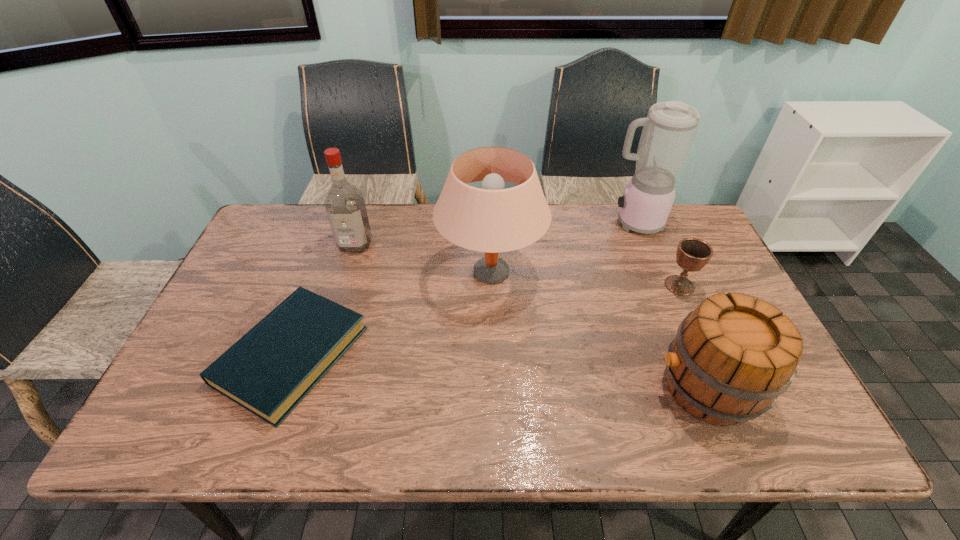
Where is `free area in between the shortest object and the fourth tallest object`? This screenshot has width=960, height=540. free area in between the shortest object and the fourth tallest object is located at coordinates (499, 372).

Locate which object is the closest to the lampshade. Please provide its 2D coordinates. Your answer should be formatted as a tuple, i.e. [(x, y)], where the tuple contains the x and y coordinates of a point satisfying the conditions above.

[(268, 371)]

Where is `object that is the second closest one to the food processor`? The image size is (960, 540). object that is the second closest one to the food processor is located at coordinates (493, 219).

Where is `free space that satisfies the following two spatial constraints: 1. on the front-facing side of the third object from left to right; 2. on the right side of the second shortest object`? free space that satisfies the following two spatial constraints: 1. on the front-facing side of the third object from left to right; 2. on the right side of the second shortest object is located at coordinates (491, 286).

Locate an element on the screen. This screenshot has height=540, width=960. free space that satisfies the following two spatial constraints: 1. on the front-facing side of the fifth tallest object; 2. on the left side of the fourth object from right to left is located at coordinates (491, 286).

In order to click on vacant space that satisfies the following two spatial constraints: 1. on the front-facing side of the fourth object from right to left; 2. on the back side of the fifth tallest object in this screenshot , I will do `click(491, 286)`.

Where is `vacant space that satisfies the following two spatial constraints: 1. on the front-facing side of the chalice; 2. on the right side of the liquor`? The height and width of the screenshot is (540, 960). vacant space that satisfies the following two spatial constraints: 1. on the front-facing side of the chalice; 2. on the right side of the liquor is located at coordinates pos(343,286).

Locate an element on the screen. This screenshot has width=960, height=540. vacant space that satisfies the following two spatial constraints: 1. on the base of the food processor near the control knob; 2. on the left side of the chalice is located at coordinates (660, 286).